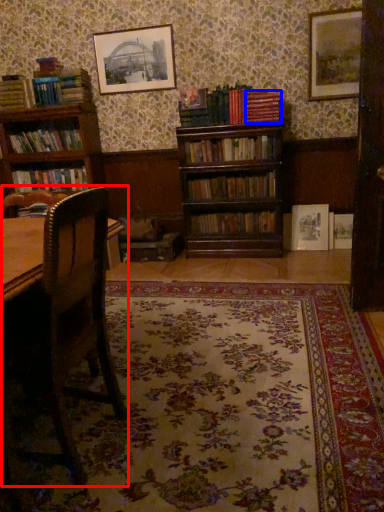
Question: Among these objects, which one is nearest to the camera, rocking chair (highlighted by a red box) or book (highlighted by a blue box)?

Choices:
 (A) rocking chair
 (B) book

Answer: (A)